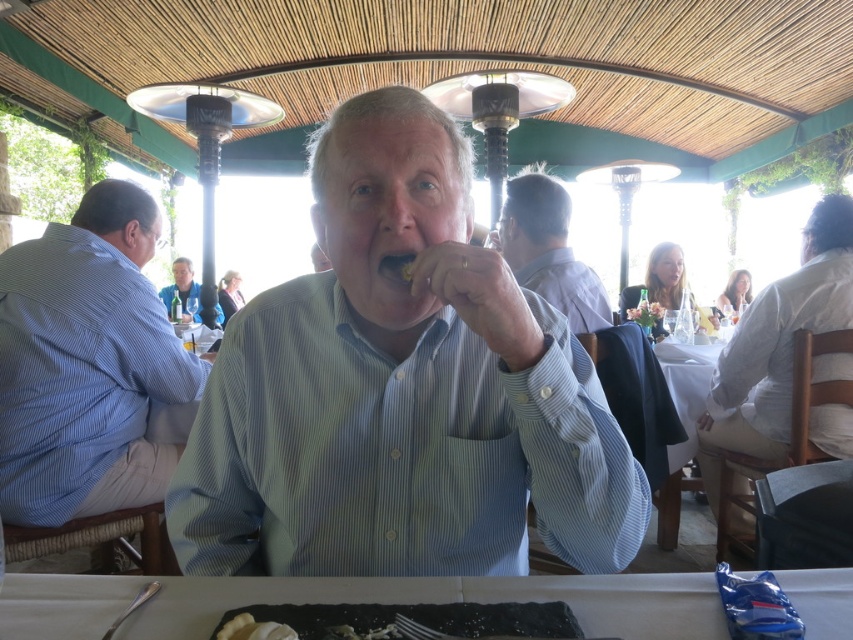
Question: Which object is positioned closest to the white matte table at center?

Choices:
 (A) light blue striped shirt at center
 (B) blue shirt at center
 (C) white creamy oyster at lower center

Answer: (A)

Question: Is blue striped shirt at left positioned in front of blue shirt at center?

Choices:
 (A) no
 (B) yes

Answer: (B)

Question: Does blue striped shirt at left appear over matte blue shirt at center?

Choices:
 (A) yes
 (B) no

Answer: (B)

Question: Which point is farther to the camera?

Choices:
 (A) smooth yellow teeth at center
 (B) white creamy oyster at lower center
 (C) matte blue shirt at upper center
 (D) light blue striped shirt at center

Answer: (C)

Question: Does light blue striped shirt at center appear on the left side of matte blue shirt at center?

Choices:
 (A) yes
 (B) no

Answer: (B)

Question: Which object appears farthest from the camera in this image?

Choices:
 (A) smooth yellow teeth at center
 (B) yellow crumbly food at mouth
 (C) white cotton shirt at right
 (D) blue striped shirt at left

Answer: (C)